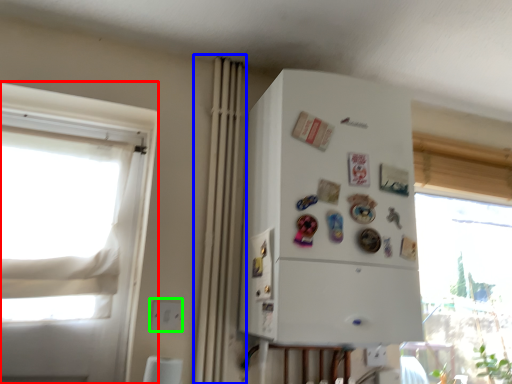
Question: Considering the real-world distances, which object is closest to window (highlighted by a red box)? curtain (highlighted by a blue box) or electric outlet (highlighted by a green box).

Choices:
 (A) curtain
 (B) electric outlet

Answer: (A)